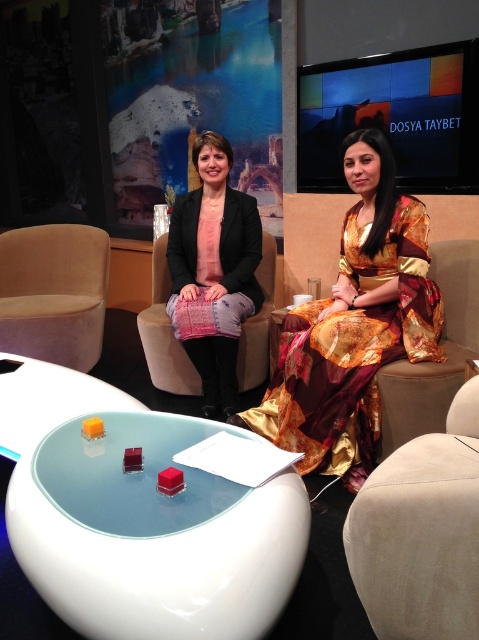
Question: Which object appears closest to the camera in this image?

Choices:
 (A) velvet armchair at center
 (B) gold satin dress at center
 (C) black fabric armchair at center

Answer: (B)

Question: Which of the following is the closest to the observer?

Choices:
 (A) (418, 406)
 (B) (33, 228)
 (C) (327, 412)

Answer: (A)

Question: Where is beige suede armchair at right located in relation to velvet armchair at center in the image?

Choices:
 (A) above
 (B) below

Answer: (B)

Question: Does matte black blazer at center appear over black fabric armchair at center?

Choices:
 (A) yes
 (B) no

Answer: (A)

Question: Can you confirm if velvet beige armchair at left is positioned above black fabric armchair at center?

Choices:
 (A) yes
 (B) no

Answer: (A)

Question: Which of the following is the closest to the observer?

Choices:
 (A) matte black blazer at center
 (B) velvet beige armchair at left
 (C) velvet armchair at center

Answer: (C)